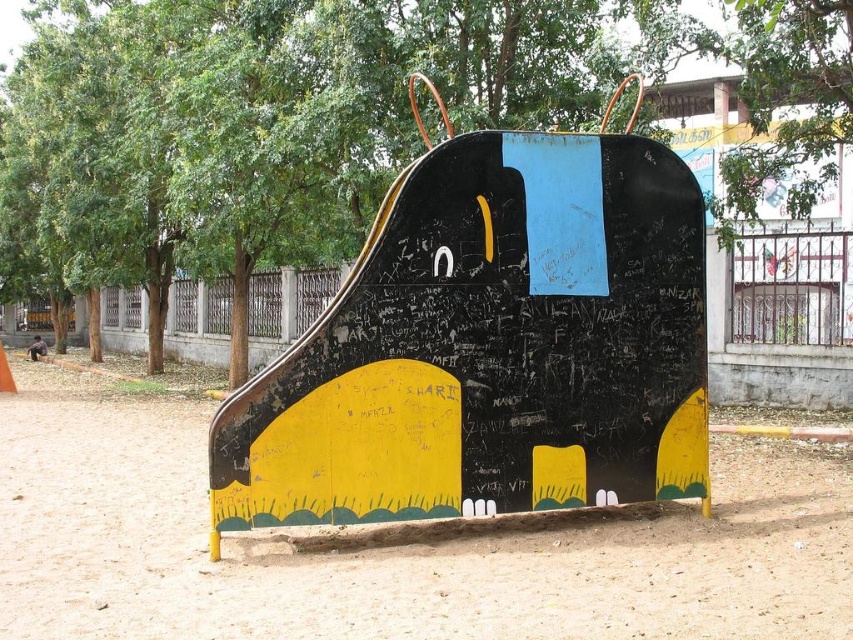
Question: Is matte black slide at center to the left of fine-grained sand at lower center from the viewer's perspective?

Choices:
 (A) yes
 (B) no

Answer: (B)

Question: Which of the following is the farthest from the observer?

Choices:
 (A) matte black slide at center
 (B) fine-grained sand at lower center

Answer: (A)

Question: Can you confirm if matte black slide at center is smaller than fine-grained sand at lower center?

Choices:
 (A) yes
 (B) no

Answer: (A)

Question: Is matte black slide at center to the right of fine-grained sand at lower center from the viewer's perspective?

Choices:
 (A) yes
 (B) no

Answer: (A)